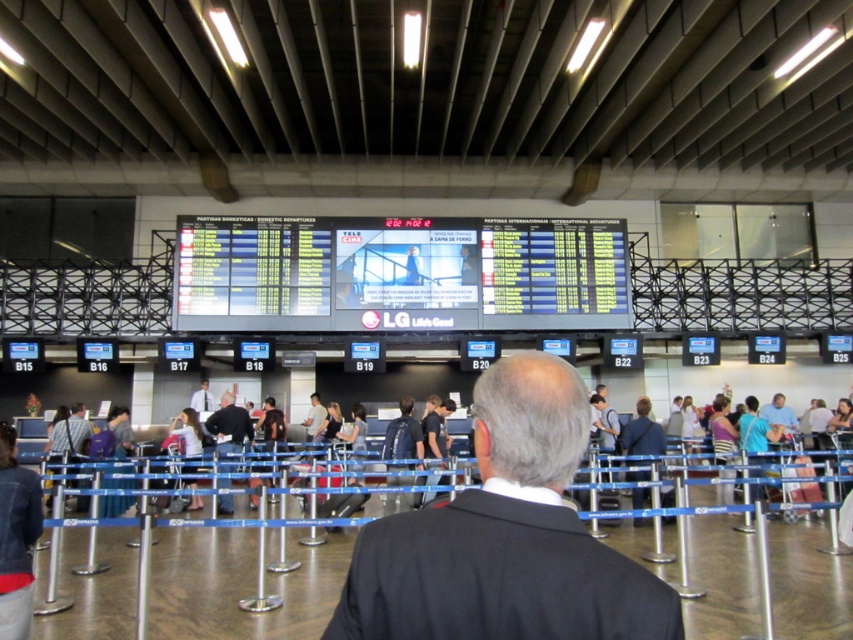
Question: Which object is the farthest from the striped shirt at left?

Choices:
 (A) black smooth shirt at center
 (B) light brown leather jacket at center

Answer: (B)

Question: Where is black suit coat at center located in relation to black smooth shirt at center in the image?

Choices:
 (A) above
 (B) below

Answer: (A)

Question: Based on their relative distances, which object is farther from the striped shirt at left?

Choices:
 (A) black smooth shirt at center
 (B) black suit coat at center
 (C) light brown leather jacket at center

Answer: (B)

Question: Can you confirm if striped shirt at left is wider than light brown leather jacket at center?

Choices:
 (A) no
 (B) yes

Answer: (B)

Question: Does black smooth shirt at center appear under striped shirt at left?

Choices:
 (A) yes
 (B) no

Answer: (B)

Question: Which point is farther to the camera?

Choices:
 (A) (651, 605)
 (B) (309, 410)
 (C) (241, 426)
 (D) (77, 454)

Answer: (B)